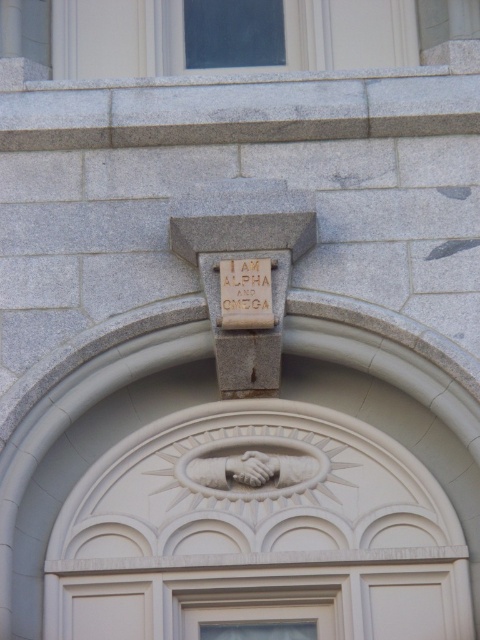
Question: Is white painted wood door at center thinner than red stone inscription at center?

Choices:
 (A) no
 (B) yes

Answer: (A)

Question: Can you confirm if white painted wood door at center is positioned above red stone inscription at center?

Choices:
 (A) no
 (B) yes

Answer: (A)

Question: Does white painted wood door at center appear on the right side of red stone inscription at center?

Choices:
 (A) yes
 (B) no

Answer: (A)

Question: Which point is closer to the camera?

Choices:
 (A) white painted wood door at center
 (B) red stone inscription at center

Answer: (A)